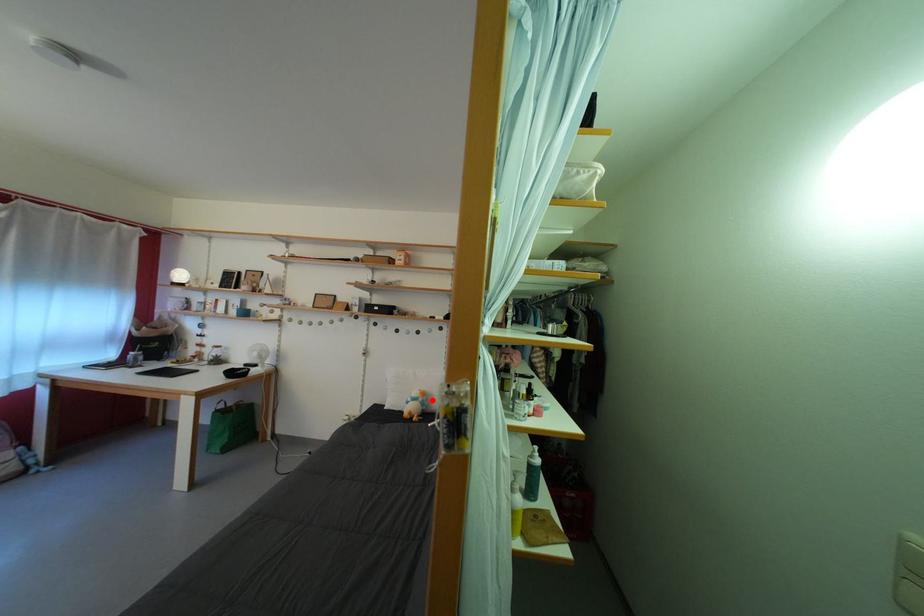
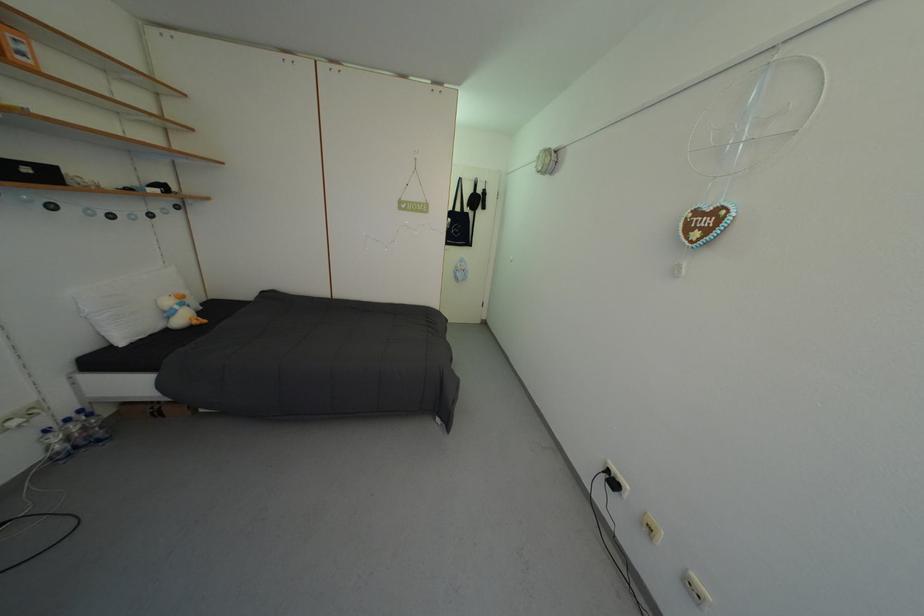
Find the pixel in the second image that matches the highlighted location in the first image.

(190, 302)